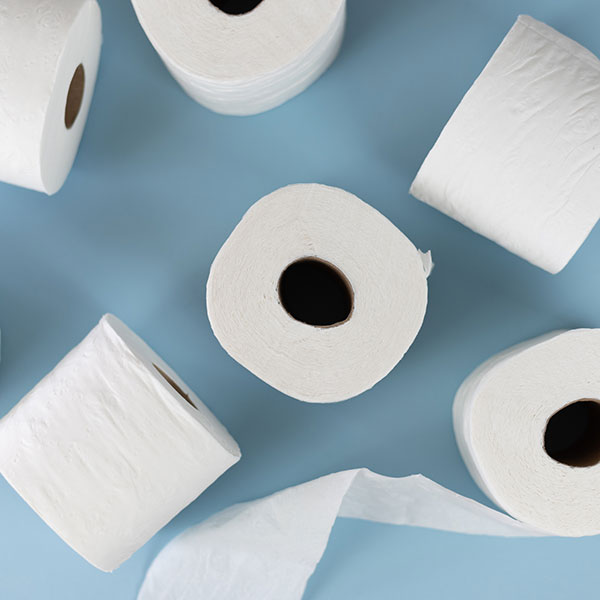
Find the location of a particular element. This screenshot has height=600, width=600. tissue rolls (unused) is located at coordinates (67, 124), (269, 87), (326, 221), (588, 123), (149, 379).